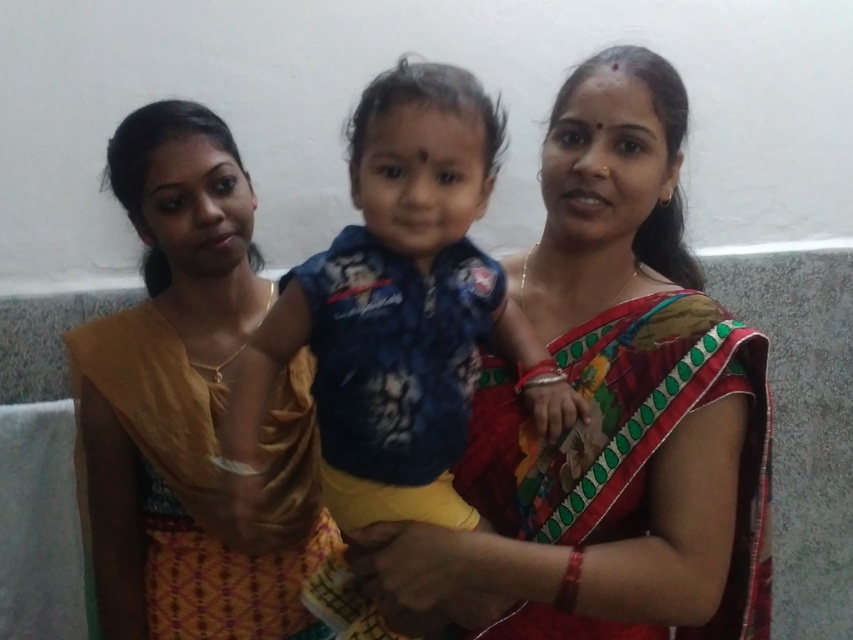
Question: Which of the following is the farthest from the observer?

Choices:
 (A) silk saree at center
 (B) matte yellow saree at left

Answer: (B)

Question: Where is silk saree at center located in relation to blue cotton shirt at center in the image?

Choices:
 (A) above
 (B) below

Answer: (B)

Question: Considering the real-world distances, which object is farthest from the silk saree at center?

Choices:
 (A) matte yellow saree at left
 (B) blue cotton shirt at center

Answer: (A)

Question: Can you confirm if matte yellow saree at left is positioned to the left of blue cotton shirt at center?

Choices:
 (A) yes
 (B) no

Answer: (A)

Question: Can you confirm if matte yellow saree at left is positioned to the right of blue cotton shirt at center?

Choices:
 (A) no
 (B) yes

Answer: (A)

Question: Which object is closer to the camera taking this photo?

Choices:
 (A) matte yellow saree at left
 (B) blue cotton shirt at center
 (C) silk saree at center

Answer: (B)